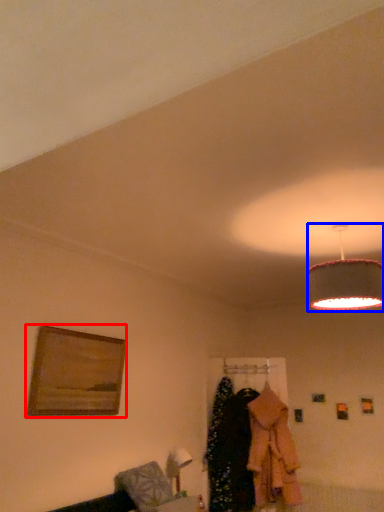
Question: Which point is further to the camera, picture frame (highlighted by a red box) or lamp (highlighted by a blue box)?

Choices:
 (A) picture frame
 (B) lamp

Answer: (A)